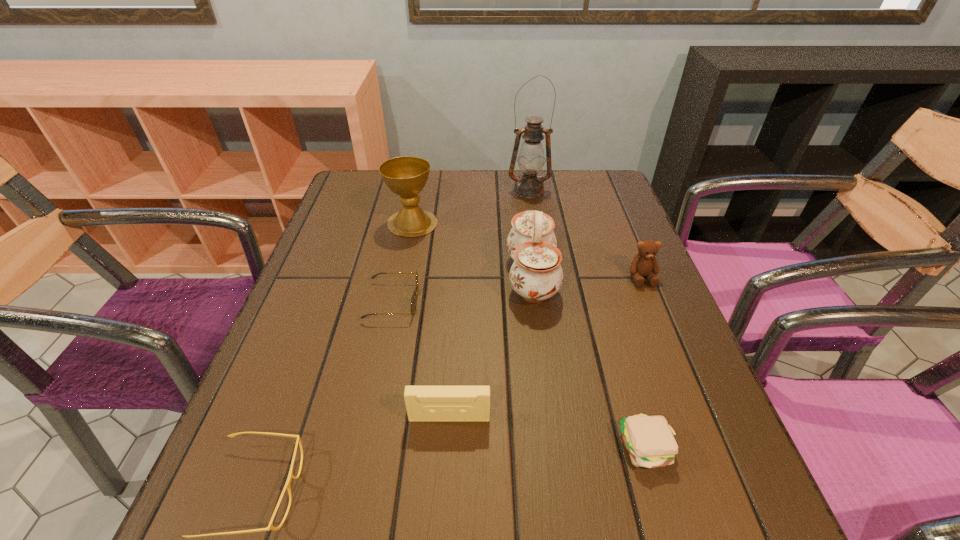
The image size is (960, 540). In order to click on vacant position at the far right corner of the desktop in this screenshot , I will do `click(560, 183)`.

You are a GUI agent. You are given a task and a screenshot of the screen. Output one action in this format:
    pyautogui.click(x=<x>, y=<y>)
    Task: Click on the free point between the second farthest object and the second object from right to left
    The height and width of the screenshot is (540, 960).
    Given the screenshot: What is the action you would take?
    pyautogui.click(x=530, y=335)

Locate an element on the screen. The height and width of the screenshot is (540, 960). vacant area that lies between the fourth shortest object and the patty is located at coordinates (548, 433).

The image size is (960, 540). Identify the location of vacant area that lies between the chinaware and the teddy bear. (587, 277).

This screenshot has width=960, height=540. In order to click on vacant space that's between the videotape and the chinaware in this screenshot , I will do `click(491, 347)`.

Locate an element on the screen. This screenshot has width=960, height=540. free space that is in between the tallest object and the second farthest object is located at coordinates (470, 207).

You are a GUI agent. You are given a task and a screenshot of the screen. Output one action in this format:
    pyautogui.click(x=<x>, y=<y>)
    Task: Click on the free space between the sunglasses and the fifth tallest object
    This screenshot has width=960, height=540.
    Given the screenshot: What is the action you would take?
    pyautogui.click(x=421, y=360)

Locate an element on the screen. The height and width of the screenshot is (540, 960). the fifth closest object to the fifth shortest object is located at coordinates (406, 176).

Locate which object ranks fifth in proximity to the tallest object. Please provide its 2D coordinates. Your answer should be formatted as a tuple, i.e. [(x, y)], where the tuple contains the x and y coordinates of a point satisfying the conditions above.

[(423, 403)]

Where is `free space that satisfies the following two spatial constraints: 1. at the front of the second object from right to left with spools; 2. on the right side of the videotape`? The height and width of the screenshot is (540, 960). free space that satisfies the following two spatial constraints: 1. at the front of the second object from right to left with spools; 2. on the right side of the videotape is located at coordinates (447, 448).